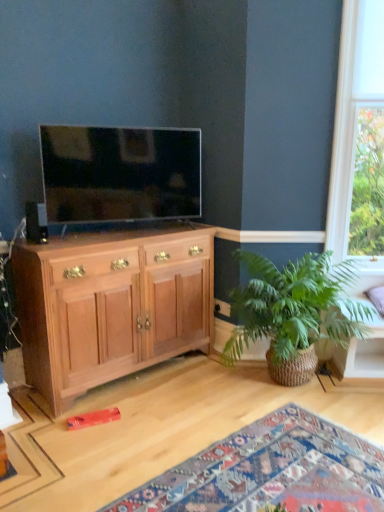
Question: From the image's perspective, is matte black tv at upper left below wooden cabinet at left?

Choices:
 (A) no
 (B) yes

Answer: (A)

Question: Is matte black tv at upper left wider than wooden cabinet at left?

Choices:
 (A) no
 (B) yes

Answer: (A)

Question: Is matte black tv at upper left positioned before wooden cabinet at left?

Choices:
 (A) no
 (B) yes

Answer: (A)

Question: Is matte black tv at upper left positioned far away from wooden cabinet at left?

Choices:
 (A) no
 (B) yes

Answer: (A)

Question: Does matte black tv at upper left have a lesser width compared to wooden cabinet at left?

Choices:
 (A) yes
 (B) no

Answer: (A)

Question: Considering their positions, is green woven basket at right located in front of or behind matte black tv at upper left?

Choices:
 (A) front
 (B) behind

Answer: (A)

Question: Considering the positions of point (235, 296) and point (74, 155), is point (235, 296) closer or farther from the camera than point (74, 155)?

Choices:
 (A) closer
 (B) farther

Answer: (B)

Question: In terms of width, does green woven basket at right look wider or thinner when compared to matte black tv at upper left?

Choices:
 (A) thin
 (B) wide

Answer: (B)

Question: Is green woven basket at right inside or outside of matte black tv at upper left?

Choices:
 (A) outside
 (B) inside

Answer: (A)

Question: Is wooden cabinet at left taller or shorter than wooden toy at lower left?

Choices:
 (A) tall
 (B) short

Answer: (A)

Question: Would you say wooden cabinet at left is inside or outside wooden toy at lower left?

Choices:
 (A) inside
 (B) outside

Answer: (B)

Question: Considering the positions of point (96, 340) and point (377, 448), is point (96, 340) closer or farther from the camera than point (377, 448)?

Choices:
 (A) farther
 (B) closer

Answer: (A)

Question: Is wooden cabinet at left wider or thinner than wooden toy at lower left?

Choices:
 (A) wide
 (B) thin

Answer: (B)

Question: Is wooden toy at lower left wider or thinner than wooden cabinet at left?

Choices:
 (A) thin
 (B) wide

Answer: (B)

Question: Is wooden toy at lower left bigger or smaller than wooden cabinet at left?

Choices:
 (A) big
 (B) small

Answer: (B)